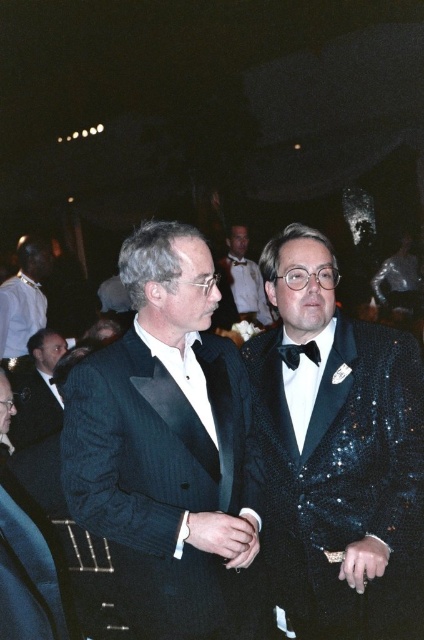
Is point (292, 419) closer to viewer compared to point (7, 600)?

No, (292, 419) is further to viewer.

Which is in front, point (423, 492) or point (8, 392)?

Point (423, 492) is more forward.

What do you see at coordinates (339, 452) in the screenshot? Image resolution: width=424 pixels, height=640 pixels. I see `sequined tuxedo at center` at bounding box center [339, 452].

Locate an element on the screen. The width and height of the screenshot is (424, 640). sequined tuxedo at center is located at coordinates (339, 452).

Which of these two, white shirt at upper left or black satin bow tie at center, stands taller?

white shirt at upper left is taller.

I want to click on white shirt at upper left, so [x=24, y=298].

The width and height of the screenshot is (424, 640). What are the coordinates of `sequined tuxedo at center` in the screenshot? It's located at (339, 452).

What do you see at coordinates (339, 452) in the screenshot?
I see `sequined tuxedo at center` at bounding box center [339, 452].

Find the location of a particular element. sequined tuxedo at center is located at coordinates (339, 452).